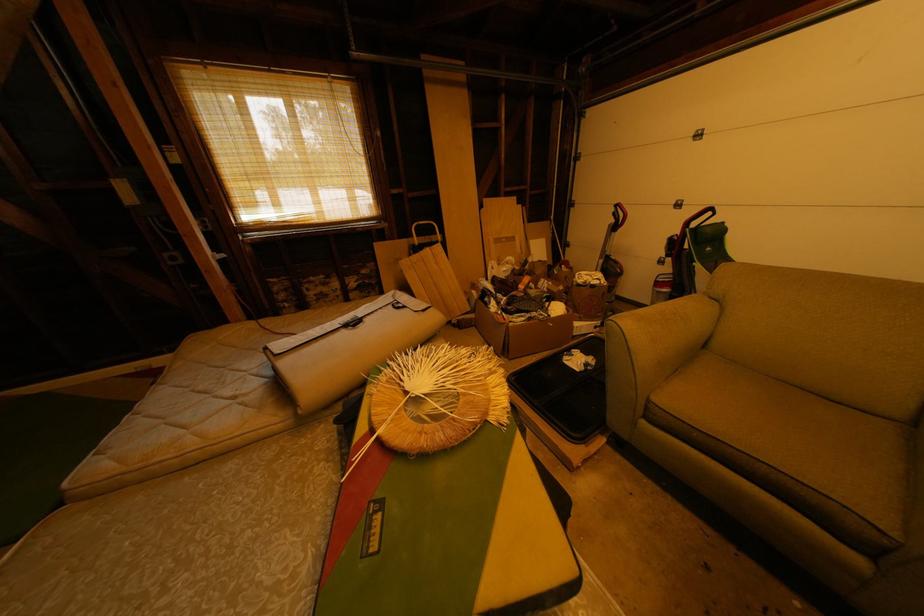
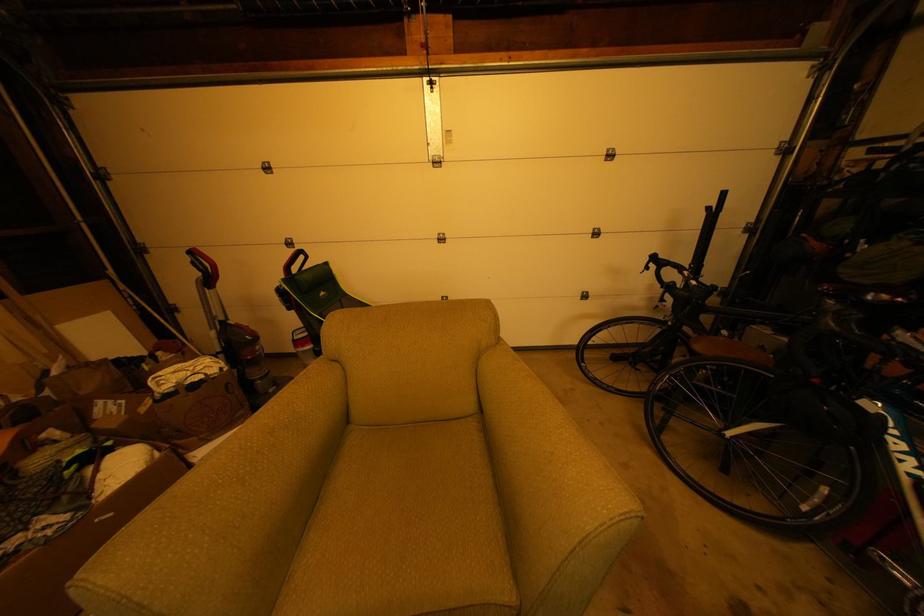
Question: The camera is either moving clockwise (left) or counter-clockwise (right) around the object. The first image is from the beginning of the video and the second image is from the end. Is the camera moving left or right when shooting the video?

Choices:
 (A) Left
 (B) Right

Answer: (A)